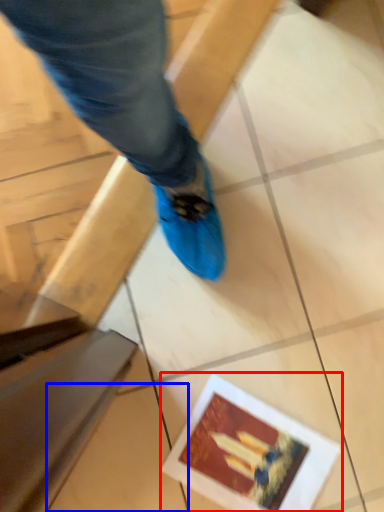
Question: Among these objects, which one is farthest to the camera, postcard (highlighted by a red box) or tile (highlighted by a blue box)?

Choices:
 (A) postcard
 (B) tile

Answer: (A)